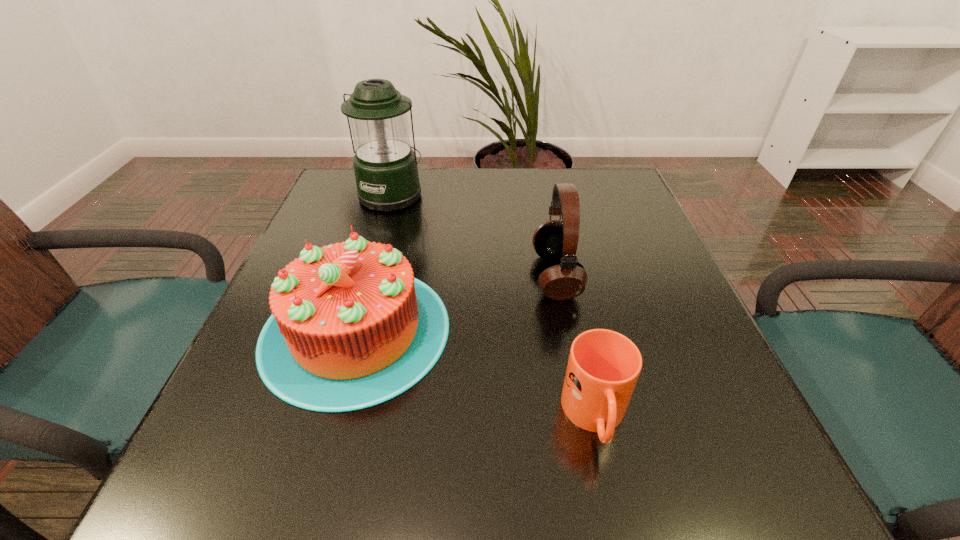
The height and width of the screenshot is (540, 960). Identify the location of vacant area that lies between the tallest object and the shortest object. (493, 306).

Locate an element on the screen. This screenshot has height=540, width=960. vacant area between the lantern and the mug is located at coordinates (493, 306).

Find the location of a particular element. The height and width of the screenshot is (540, 960). empty space between the headset and the cake is located at coordinates 456,303.

The image size is (960, 540). What are the coordinates of `free space that is in between the headset and the cake` in the screenshot? It's located at (456, 303).

The width and height of the screenshot is (960, 540). In order to click on free area in between the headset and the cake in this screenshot , I will do `click(456, 303)`.

At what (x,y) coordinates should I click in order to perform the action: click on free point between the cake and the mug. Please return your answer as a coordinate pair (x, y). Looking at the image, I should click on (475, 374).

You are a GUI agent. You are given a task and a screenshot of the screen. Output one action in this format:
    pyautogui.click(x=<x>, y=<y>)
    Task: Click on the free space between the cake and the headset
    
    Given the screenshot: What is the action you would take?
    pyautogui.click(x=456, y=303)

Locate an element on the screen. This screenshot has width=960, height=540. empty space that is in between the headset and the cake is located at coordinates (456, 303).

Find the location of a particular element. This screenshot has height=540, width=960. object that is the second closest to the shortest object is located at coordinates (351, 328).

Identify which object is the second closest to the headset. Please provide its 2D coordinates. Your answer should be formatted as a tuple, i.e. [(x, y)], where the tuple contains the x and y coordinates of a point satisfying the conditions above.

[(351, 328)]